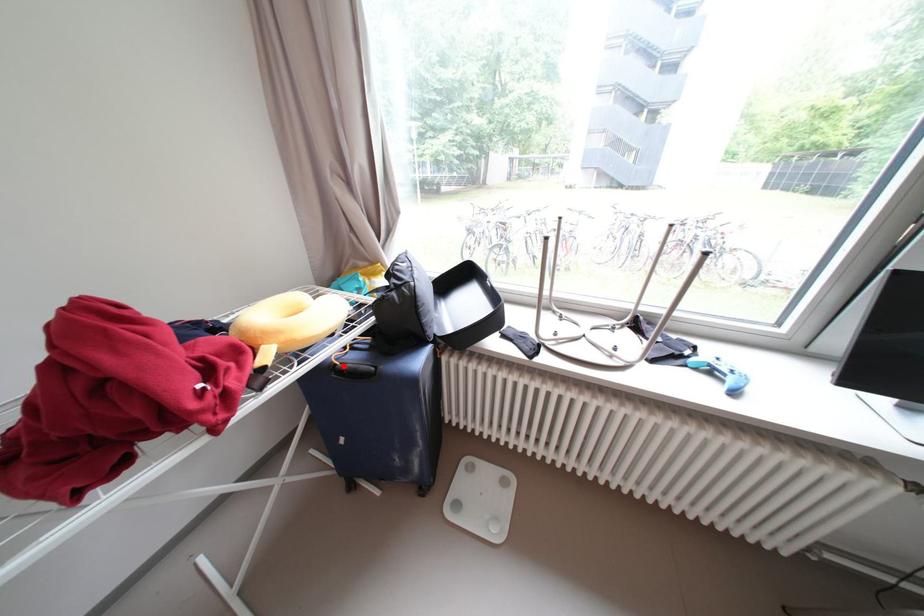
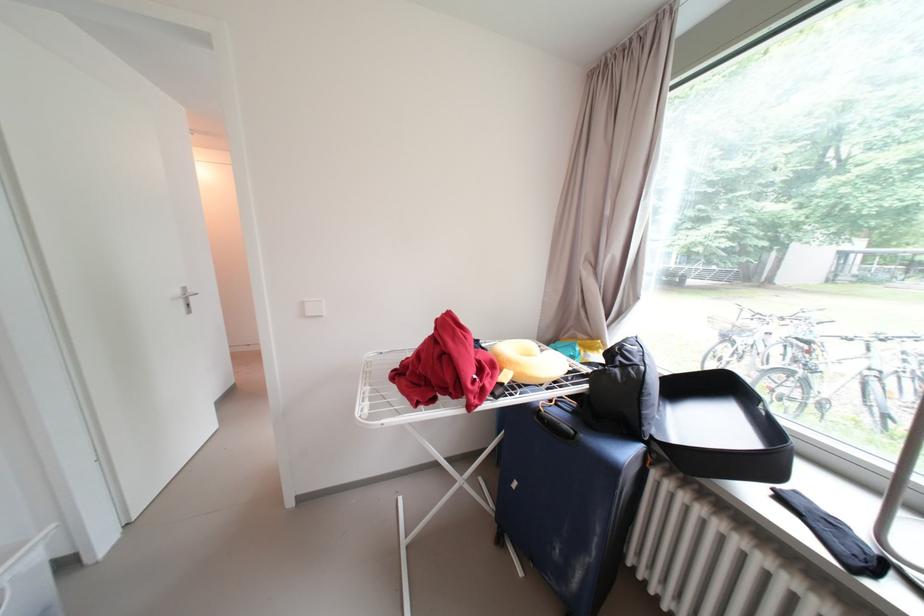
In the second image, find the point that corresponds to the highlighted location in the first image.

(549, 411)